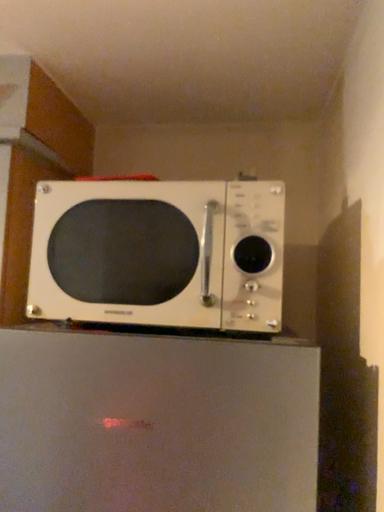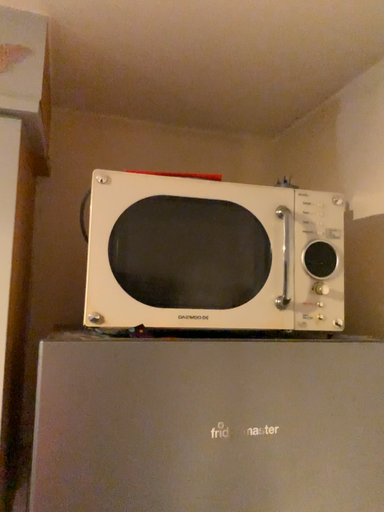
Question: Which way did the camera rotate in the video?

Choices:
 (A) rotated right
 (B) rotated left

Answer: (A)